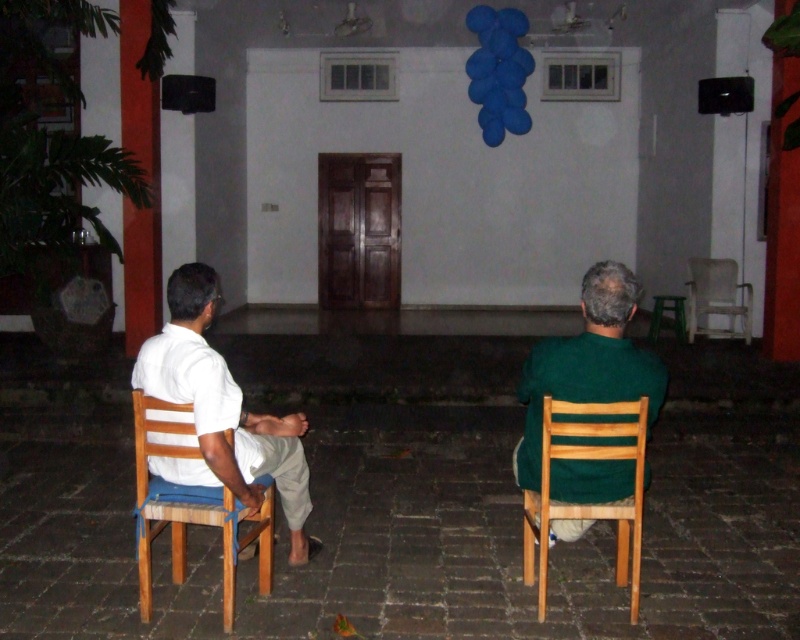
You are standing in the courtyard and need to locate the green matte shirt at right. According to the coordinates provided, where exactly is it positioned in the image?

The green matte shirt at right is located at the 2D coordinates point (588, 364) in the image.